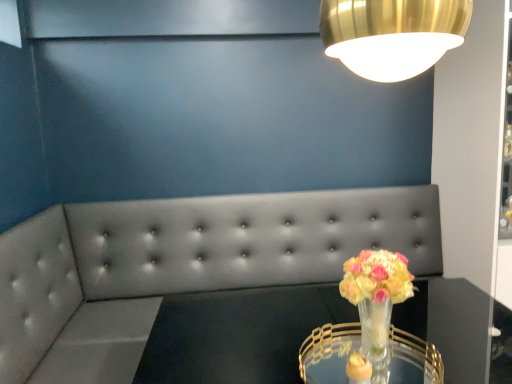
Question: Are tufted leather couch at center and translucent glass vase at center located far from each other?

Choices:
 (A) no
 (B) yes

Answer: (B)

Question: Can you confirm if tufted leather couch at center is bigger than translucent glass vase at center?

Choices:
 (A) yes
 (B) no

Answer: (A)

Question: Is tufted leather couch at center wider than translucent glass vase at center?

Choices:
 (A) no
 (B) yes

Answer: (B)

Question: From the image's perspective, is tufted leather couch at center over translucent glass vase at center?

Choices:
 (A) no
 (B) yes

Answer: (A)

Question: Considering the relative sizes of tufted leather couch at center and translucent glass vase at center in the image provided, is tufted leather couch at center taller than translucent glass vase at center?

Choices:
 (A) no
 (B) yes

Answer: (B)

Question: Is tufted leather couch at center positioned with its back to translucent glass vase at center?

Choices:
 (A) no
 (B) yes

Answer: (A)

Question: From the image's perspective, is tufted leather couch at center located beneath clear glass table at center?

Choices:
 (A) yes
 (B) no

Answer: (A)

Question: Is tufted leather couch at center outside clear glass table at center?

Choices:
 (A) yes
 (B) no

Answer: (A)

Question: Is tufted leather couch at center wider than clear glass table at center?

Choices:
 (A) yes
 (B) no

Answer: (A)

Question: Are tufted leather couch at center and clear glass table at center far apart?

Choices:
 (A) no
 (B) yes

Answer: (A)

Question: Does tufted leather couch at center have a smaller size compared to clear glass table at center?

Choices:
 (A) yes
 (B) no

Answer: (B)

Question: Does tufted leather couch at center appear on the left side of clear glass table at center?

Choices:
 (A) no
 (B) yes

Answer: (B)

Question: Considering the relative sizes of clear glass table at center and translucent glass vase at center in the image provided, is clear glass table at center thinner than translucent glass vase at center?

Choices:
 (A) yes
 (B) no

Answer: (B)